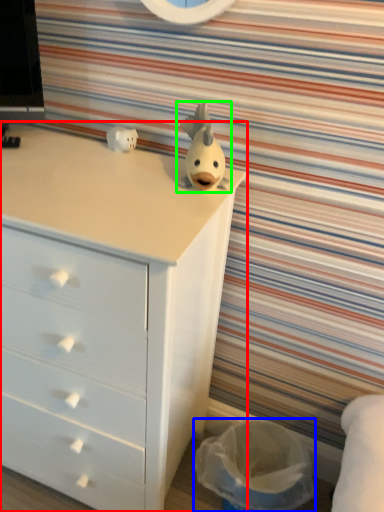
Question: Considering the real-world distances, which object is farthest from chest of drawers (highlighted by a red box)? laundry basket (highlighted by a blue box) or toy (highlighted by a green box)?

Choices:
 (A) laundry basket
 (B) toy

Answer: (A)